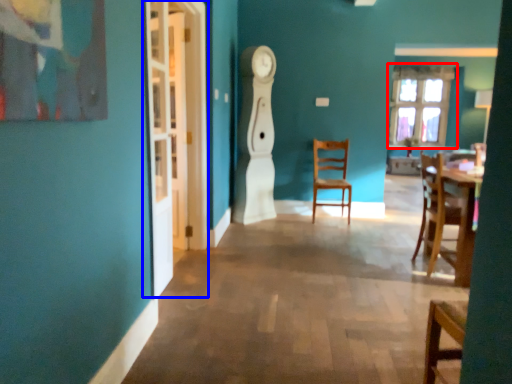
Question: Which object appears farthest to the camera in this image, window (highlighted by a red box) or glass door (highlighted by a blue box)?

Choices:
 (A) window
 (B) glass door

Answer: (A)